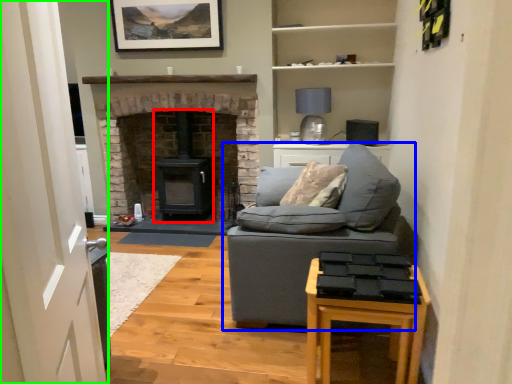
Question: Which object is the closest to the wood burning stove (highlighted by a red box)? Choose among these: studio couch (highlighted by a blue box) or glass door (highlighted by a green box).

Choices:
 (A) studio couch
 (B) glass door

Answer: (A)